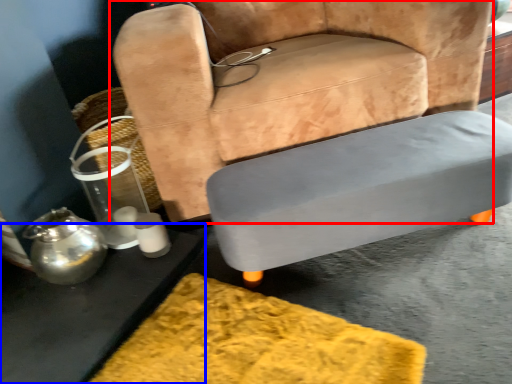
Question: Which object appears closest to the camera in this image, chair (highlighted by a red box) or table (highlighted by a blue box)?

Choices:
 (A) chair
 (B) table

Answer: (B)